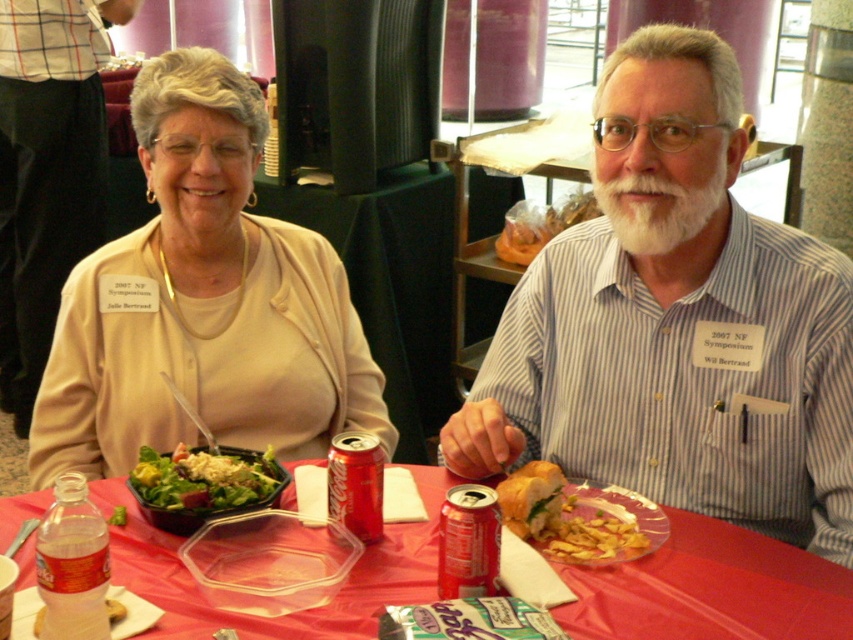
Who is taller, clear plastic bottle at table center or fresh green salad at left?

With more height is clear plastic bottle at table center.

Who is shorter, clear plastic bottle at table center or fresh green salad at left?

fresh green salad at left is shorter.

Which is behind, point (49, 596) or point (155, 452)?

The point (155, 452) is behind.

At what (x,y) coordinates should I click in order to perform the action: click on clear plastic bottle at table center. Please return your answer as a coordinate pair (x, y). The height and width of the screenshot is (640, 853). Looking at the image, I should click on (73, 564).

Does matte beige sweater at upper left come in front of red matte soda can at center?

No.

Can you confirm if matte beige sweater at upper left is smaller than red matte soda can at center?

Incorrect, matte beige sweater at upper left is not smaller in size than red matte soda can at center.

What do you see at coordinates (202, 304) in the screenshot? The width and height of the screenshot is (853, 640). I see `matte beige sweater at upper left` at bounding box center [202, 304].

This screenshot has height=640, width=853. What are the coordinates of `matte beige sweater at upper left` in the screenshot? It's located at [202, 304].

Based on the photo, does matte beige sweater at upper left come behind golden crispy chips at center?

Yes, it is behind golden crispy chips at center.

Does point (206, 144) come in front of point (648, 509)?

That is False.

The image size is (853, 640). I want to click on matte beige sweater at upper left, so click(202, 304).